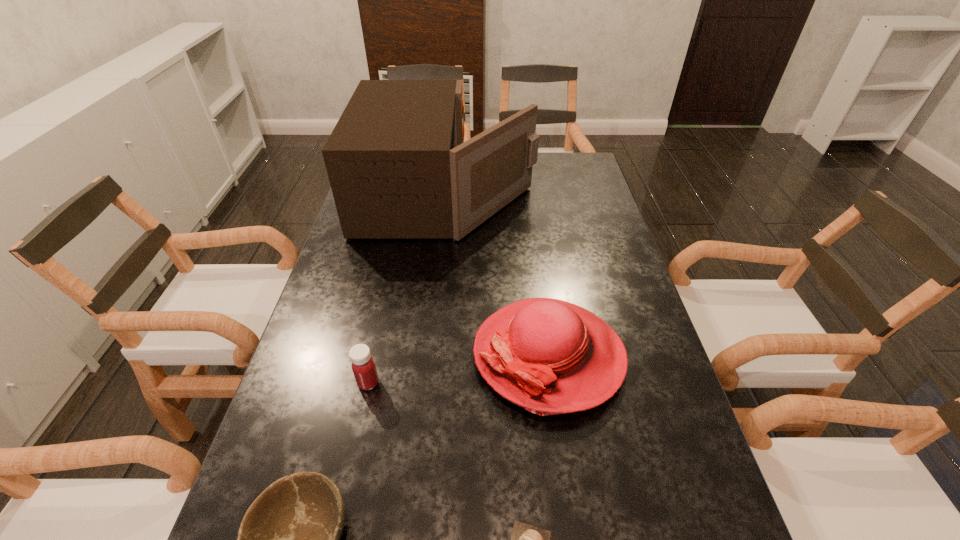
Locate an element on the screen. The image size is (960, 540). microwave oven is located at coordinates (398, 166).

In order to click on the tallest object in this screenshot , I will do pyautogui.click(x=398, y=166).

Identify the location of hat. (549, 356).

Locate an element on the screen. The image size is (960, 540). the third tallest object is located at coordinates (363, 366).

At what (x,y) coordinates should I click in order to perform the action: click on vacant space located with the door open on the front of the farthest object. Please return your answer as a coordinate pair (x, y). Looking at the image, I should click on (556, 195).

The image size is (960, 540). I want to click on free location located at the front of the second tallest object with a bow, so click(x=345, y=355).

Where is `free space located at the front of the second tallest object with a bow`? The image size is (960, 540). free space located at the front of the second tallest object with a bow is located at coordinates (310, 355).

You are a GUI agent. You are given a task and a screenshot of the screen. Output one action in this format:
    pyautogui.click(x=<x>, y=<y>)
    Task: Click on the vacant region located at the front of the second tallest object with a bow
    The height and width of the screenshot is (540, 960).
    Given the screenshot: What is the action you would take?
    pyautogui.click(x=385, y=355)

Locate an element on the screen. The image size is (960, 540). vacant region located 0.170m on the right of the medicine is located at coordinates [x=458, y=383].

You are a GUI agent. You are given a task and a screenshot of the screen. Output one action in this format:
    pyautogui.click(x=<x>, y=<y>)
    Task: Click on the object that is at the far edge
    This screenshot has height=540, width=960.
    Given the screenshot: What is the action you would take?
    pyautogui.click(x=398, y=166)